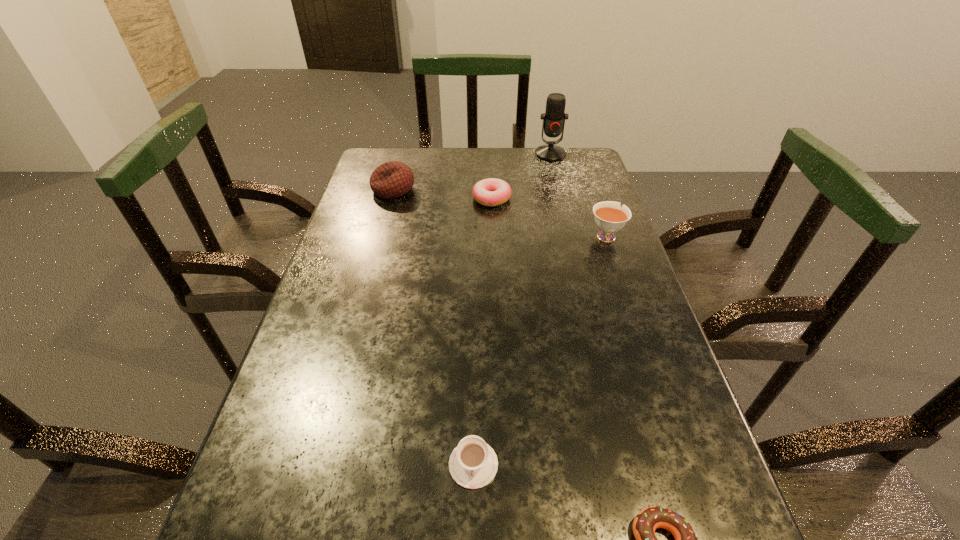
Locate an element on the screen. The image size is (960, 540). empty space that is in between the taller teacup and the leftmost object is located at coordinates pyautogui.click(x=499, y=212).

Where is `empty location between the nearer teacup and the farthest object`? The height and width of the screenshot is (540, 960). empty location between the nearer teacup and the farthest object is located at coordinates (512, 309).

Identify which object is the third closest to the nearer teacup. Please provide its 2D coordinates. Your answer should be formatted as a tuple, i.e. [(x, y)], where the tuple contains the x and y coordinates of a point satisfying the conditions above.

[(490, 192)]

Identify the location of object identified as the closest to the taller teacup. (490, 192).